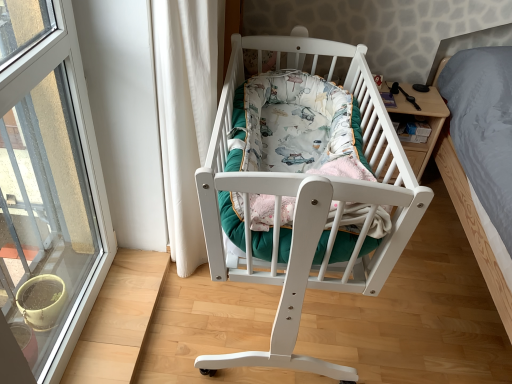
Question: Does transparent glass window at left have a lesser width compared to white wood crib at center?

Choices:
 (A) no
 (B) yes

Answer: (B)

Question: Is transparent glass window at left bigger than white wood crib at center?

Choices:
 (A) yes
 (B) no

Answer: (B)

Question: Is transparent glass window at left directly adjacent to white wood crib at center?

Choices:
 (A) yes
 (B) no

Answer: (B)

Question: From a real-world perspective, is transparent glass window at left located higher than white wood crib at center?

Choices:
 (A) no
 (B) yes

Answer: (B)

Question: Considering the relative sizes of transparent glass window at left and white wood crib at center in the image provided, is transparent glass window at left smaller than white wood crib at center?

Choices:
 (A) yes
 (B) no

Answer: (A)

Question: Is transparent glass window at left not inside white wood crib at center?

Choices:
 (A) no
 (B) yes

Answer: (B)

Question: From the image's perspective, would you say wooden nightstand at right is shown under printed fabric mattress at center?

Choices:
 (A) no
 (B) yes

Answer: (A)

Question: Can you confirm if wooden nightstand at right is positioned to the right of printed fabric mattress at center?

Choices:
 (A) no
 (B) yes

Answer: (B)

Question: Considering the relative sizes of wooden nightstand at right and printed fabric mattress at center in the image provided, is wooden nightstand at right thinner than printed fabric mattress at center?

Choices:
 (A) yes
 (B) no

Answer: (A)

Question: Is the surface of wooden nightstand at right in direct contact with printed fabric mattress at center?

Choices:
 (A) no
 (B) yes

Answer: (A)

Question: Is wooden nightstand at right turned away from printed fabric mattress at center?

Choices:
 (A) no
 (B) yes

Answer: (A)

Question: From the image's perspective, is wooden nightstand at right on top of printed fabric mattress at center?

Choices:
 (A) no
 (B) yes

Answer: (B)

Question: Does white wood crib at center contain printed fabric mattress at center?

Choices:
 (A) yes
 (B) no

Answer: (B)